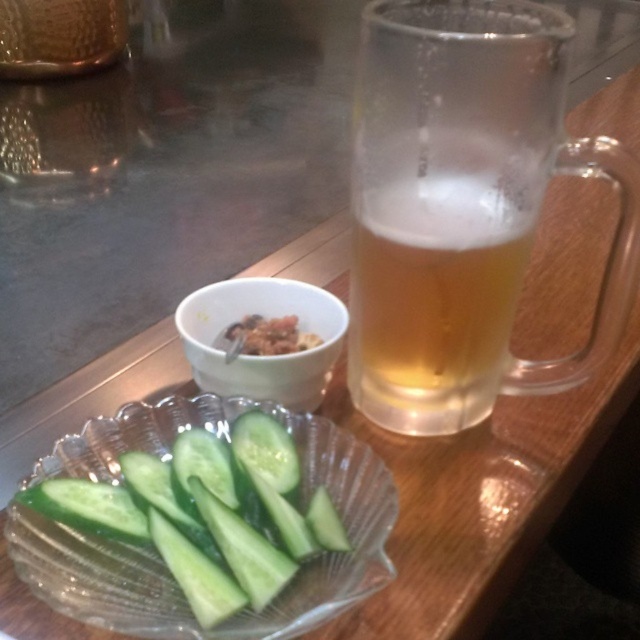
Question: Which object is farther from the camera taking this photo?

Choices:
 (A) green smooth cucumber at lower left
 (B) frothy amber glass at upper right
 (C) white matte bowl at upper center

Answer: (C)

Question: Does frothy amber glass at upper right appear on the right side of green smooth cucumber at lower left?

Choices:
 (A) yes
 (B) no

Answer: (A)

Question: Is green smooth cucumber at lower left to the right of white matte bowl at upper center from the viewer's perspective?

Choices:
 (A) yes
 (B) no

Answer: (B)

Question: Which is farther from the green smooth cucumber at lower left?

Choices:
 (A) frothy amber glass at upper right
 (B) savory crumbly snack at center

Answer: (A)

Question: Observing the image, what is the correct spatial positioning of green smooth cucumber at lower left in reference to white matte bowl at upper center?

Choices:
 (A) left
 (B) right

Answer: (A)

Question: Estimate the real-world distances between objects in this image. Which object is farther from the frothy amber glass at upper right?

Choices:
 (A) white matte bowl at upper center
 (B) savory crumbly snack at center
 (C) green smooth cucumber at lower left

Answer: (C)